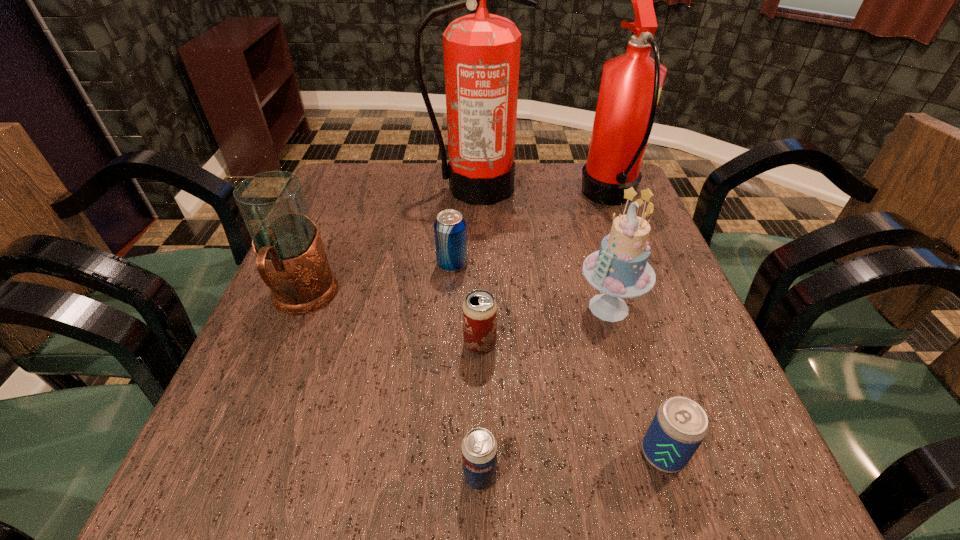
Locate an element on the screen. The image size is (960, 540). free space that is in between the left fire extinguisher and the third nearest beer can is located at coordinates (477, 266).

Locate an element on the screen. free spot between the rightmost beer can and the left fire extinguisher is located at coordinates (569, 321).

Find the location of a particular element. This screenshot has width=960, height=540. vacant space that's between the third nearest beer can and the right fire extinguisher is located at coordinates (545, 271).

The height and width of the screenshot is (540, 960). In order to click on empty space between the rightmost beer can and the leftmost object in this screenshot , I will do `click(483, 377)`.

This screenshot has width=960, height=540. Identify the location of unoccupied area between the farthest beer can and the pitcher. (377, 282).

Select which object is the sixth closest to the farthest beer can. Please provide its 2D coordinates. Your answer should be formatted as a tuple, i.e. [(x, y)], where the tuple contains the x and y coordinates of a point satisfying the conditions above.

[(479, 448)]

Identify which object is the seventh closest to the leftmost object. Please provide its 2D coordinates. Your answer should be formatted as a tuple, i.e. [(x, y)], where the tuple contains the x and y coordinates of a point satisfying the conditions above.

[(631, 84)]

The height and width of the screenshot is (540, 960). Find the location of `the second closest beer can to the right fire extinguisher`. the second closest beer can to the right fire extinguisher is located at coordinates (479, 310).

Image resolution: width=960 pixels, height=540 pixels. Identify the location of beer can that can be found as the third closest to the farthest beer can. (679, 426).

You are a GUI agent. You are given a task and a screenshot of the screen. Output one action in this format:
    pyautogui.click(x=<x>, y=<y>)
    Task: Click on the free point that satisfies the following two spatial constraints: 1. with the handle on the side of the leftmost object; 2. on the left side of the rightmost beer can
    This screenshot has width=960, height=540.
    Given the screenshot: What is the action you would take?
    pyautogui.click(x=240, y=454)